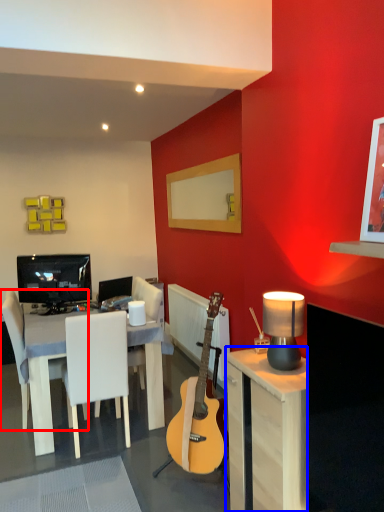
Question: Which of the following is the closest to the observer, chair (highlighted by a red box) or desk (highlighted by a blue box)?

Choices:
 (A) chair
 (B) desk

Answer: (B)